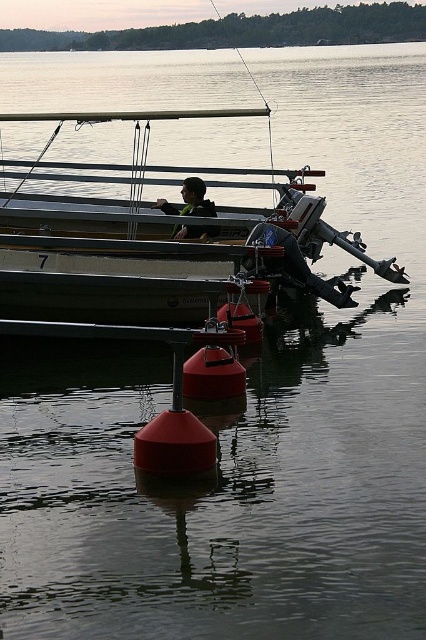
Question: Does white matte boat at center lie in front of matte black jacket at center?

Choices:
 (A) no
 (B) yes

Answer: (B)

Question: Is white matte boat at center bigger than matte black jacket at center?

Choices:
 (A) no
 (B) yes

Answer: (B)

Question: Which point appears closest to the camera in this image?

Choices:
 (A) (164, 204)
 (B) (58, 129)

Answer: (A)

Question: Can you confirm if white matte boat at center is thinner than matte black jacket at center?

Choices:
 (A) no
 (B) yes

Answer: (A)